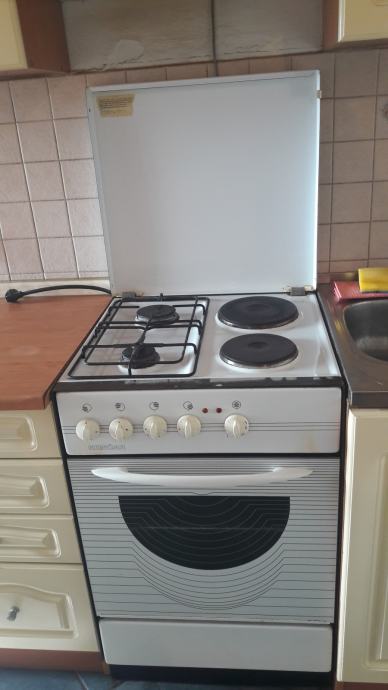
Locate an element on the screen. front covered burner is located at coordinates (263, 348).